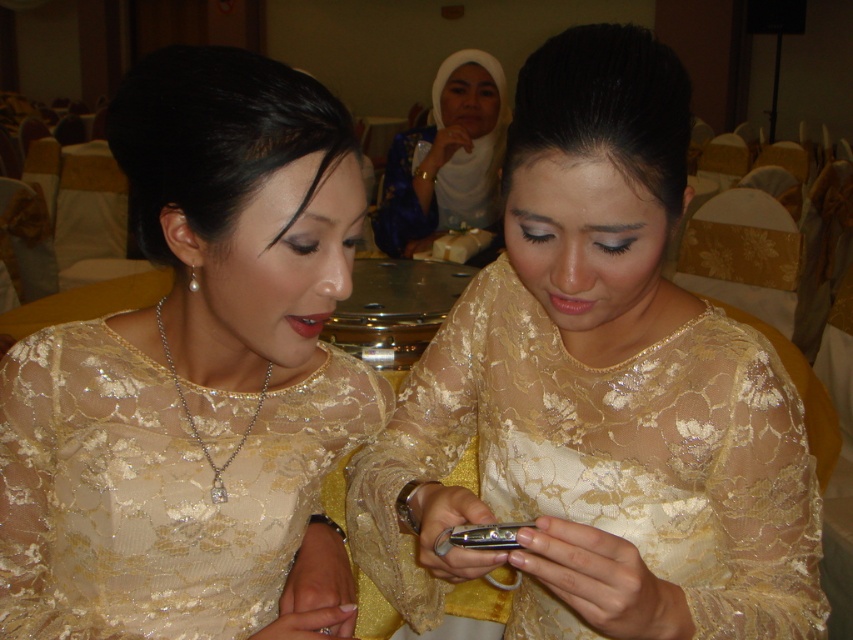
Looking at this image, does lace fabric phone at center have a lesser height compared to lace dress at center?

Incorrect, lace fabric phone at center's height does not fall short of lace dress at center's.

Who is more forward, (650, 372) or (65, 330)?

Positioned in front is point (65, 330).

Locate an element on the screen. This screenshot has height=640, width=853. lace fabric phone at center is located at coordinates (598, 394).

Between point (642, 166) and point (477, 186), which one is positioned behind?

Point (477, 186)

Does point (517, 308) lie behind point (479, 163)?

No, (517, 308) is in front of (479, 163).

Locate an element on the screen. This screenshot has width=853, height=640. lace fabric phone at center is located at coordinates (598, 394).

Is lace dress at center smaller than white lace hijab at upper center?

Yes.

Who is positioned more to the right, lace dress at center or white lace hijab at upper center?

Positioned to the right is white lace hijab at upper center.

What do you see at coordinates (155, 490) in the screenshot? This screenshot has height=640, width=853. I see `lace dress at center` at bounding box center [155, 490].

Identify the location of lace dress at center. (155, 490).